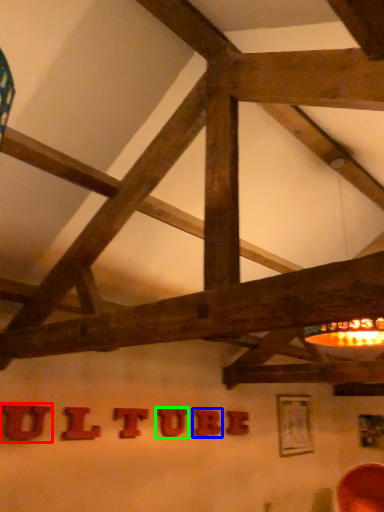
Question: Estimate the real-world distances between objects in this image. Which object is closer to letter (highlighted by a red box), letter (highlighted by a blue box) or letter (highlighted by a green box)?

Choices:
 (A) letter
 (B) letter

Answer: (B)